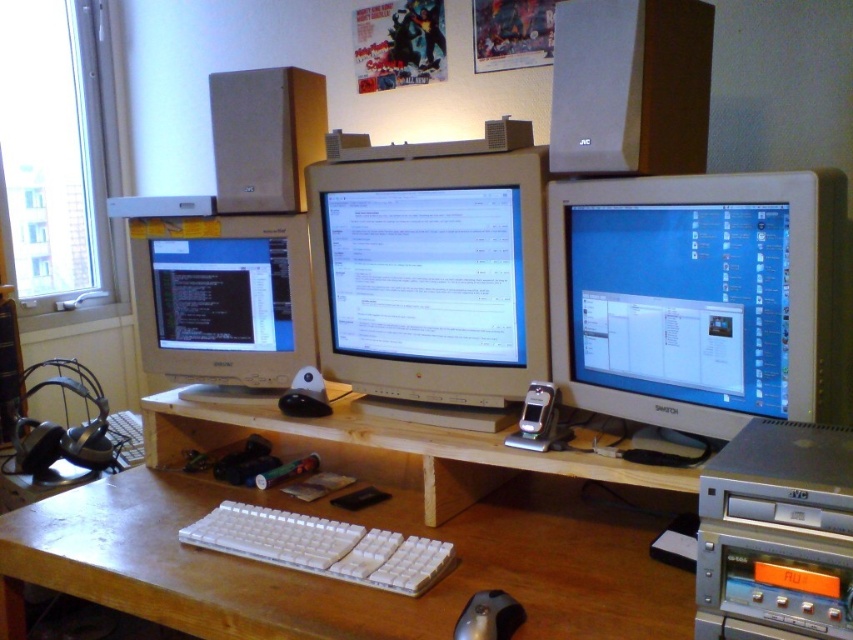
Question: Which point appears farthest from the camera in this image?

Choices:
 (A) tap(302, 80)
 (B) tap(637, 211)

Answer: (A)

Question: Which point is farther to the camera?

Choices:
 (A) matte black monitor at left
 (B) white plastic speaker at upper center
 (C) silver metallic mouse at lower center

Answer: (A)

Question: Is the position of white plastic speaker at upper center more distant than that of white plastic keyboard at center?

Choices:
 (A) yes
 (B) no

Answer: (A)

Question: Which point is closer to the camera?

Choices:
 (A) (256, 248)
 (B) (210, 544)
 (C) (503, 365)

Answer: (B)

Question: Can you confirm if white glossy monitor at center right is thinner than white plastic keyboard at center?

Choices:
 (A) no
 (B) yes

Answer: (B)

Question: Does white glossy monitor at center right appear on the right side of matte beige speaker at upper center?

Choices:
 (A) no
 (B) yes

Answer: (B)